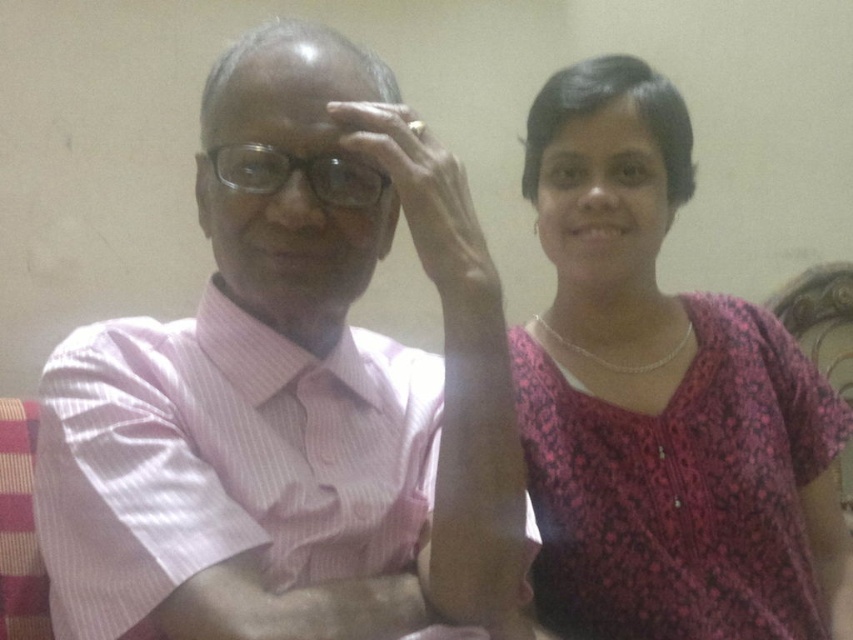
Question: Which of the following is the farthest from the observer?

Choices:
 (A) pink floral dress at right
 (B) pink striped shirt at left
 (C) transparent plastic glasses at center

Answer: (A)

Question: Does pink striped shirt at left have a smaller size compared to transparent plastic glasses at center?

Choices:
 (A) no
 (B) yes

Answer: (A)

Question: Which object is farther from the camera taking this photo?

Choices:
 (A) pink striped shirt at left
 (B) pink floral dress at right

Answer: (B)

Question: Does pink striped shirt at left have a greater width compared to transparent plastic glasses at center?

Choices:
 (A) no
 (B) yes

Answer: (B)

Question: Among these points, which one is nearest to the camera?

Choices:
 (A) (375, 182)
 (B) (532, 147)

Answer: (A)

Question: In this image, where is pink striped shirt at left located relative to transparent plastic glasses at center?

Choices:
 (A) left
 (B) right

Answer: (B)